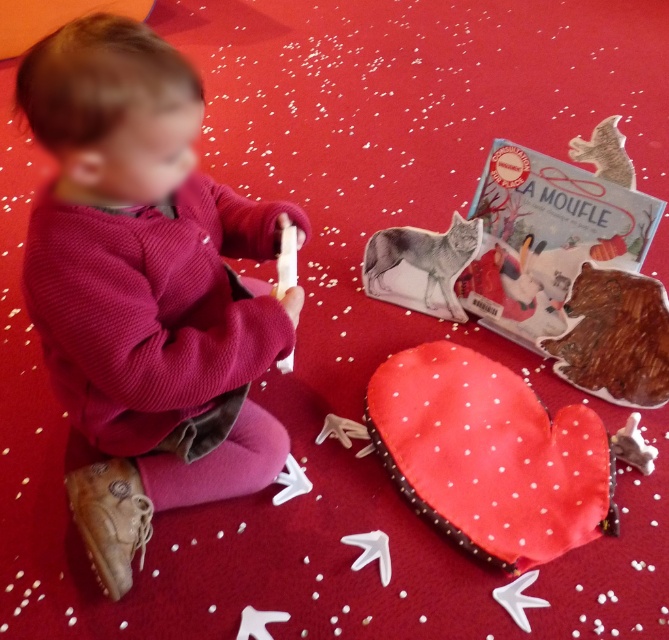
Question: Considering the real-world distances, which object is farthest from the white fabric heart at lower center?

Choices:
 (A) fuzzy gray wolf at center
 (B) metallic silver bat at upper right
 (C) smooth beige mittens at lower center
 (D) velvety pink sweater at left

Answer: (D)

Question: Does white fabric heart at lower center have a larger size compared to smooth beige mittens at lower center?

Choices:
 (A) no
 (B) yes

Answer: (B)

Question: Does white fabric heart at lower center appear on the left side of smooth beige mittens at lower center?

Choices:
 (A) yes
 (B) no

Answer: (B)

Question: Which object is the closest to the smooth beige mittens at lower center?

Choices:
 (A) metallic silver bat at upper right
 (B) white fabric heart at lower center
 (C) fuzzy gray wolf at center
 (D) velvety pink sweater at left

Answer: (C)

Question: Does velvety pink sweater at left appear under smooth beige mittens at lower center?

Choices:
 (A) yes
 (B) no

Answer: (B)

Question: Among these objects, which one is nearest to the camera?

Choices:
 (A) fuzzy gray wolf at center
 (B) metallic silver bat at upper right
 (C) velvety pink sweater at left

Answer: (C)